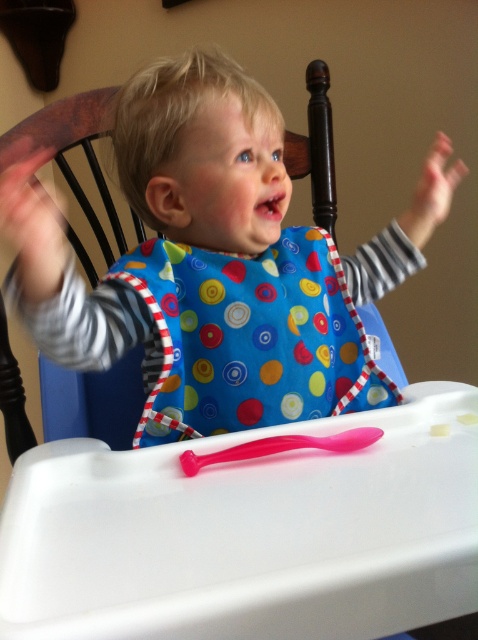
Is blue fabric bib at center bigger than pink rubber hand at upper right?

Yes, blue fabric bib at center is bigger than pink rubber hand at upper right.

Is point (82, 355) more distant than point (434, 224)?

No, it is in front of (434, 224).

Locate an element on the screen. The height and width of the screenshot is (640, 478). blue fabric bib at center is located at coordinates (203, 154).